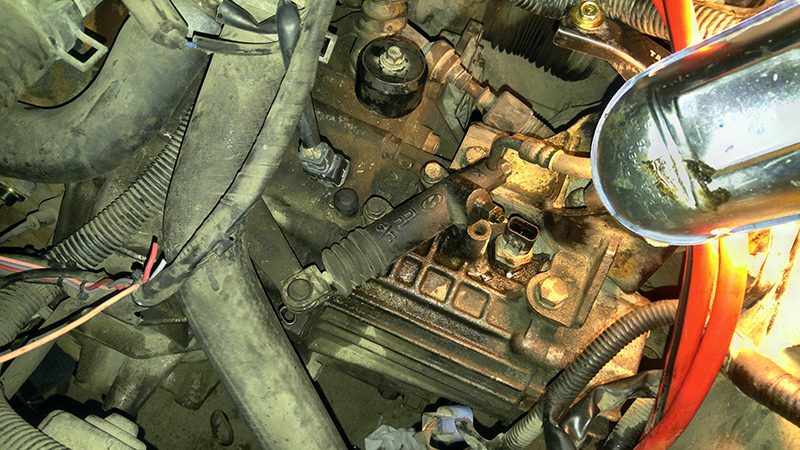
At what (x,y) coordinates should I click in order to perform the action: click on light source. Please return your answer as a coordinate pair (x, y). The width and height of the screenshot is (800, 450). Looking at the image, I should click on (790, 272).